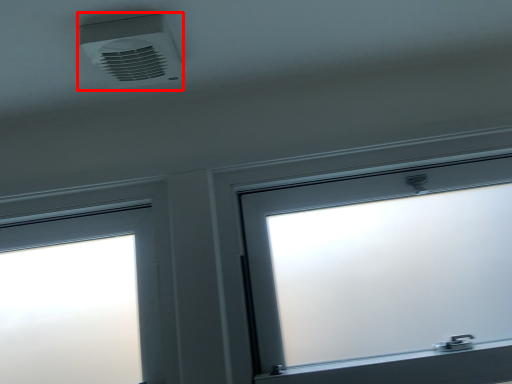
Question: In this image, where is air conditioning (annotated by the red box) located relative to window?

Choices:
 (A) right
 (B) left

Answer: (B)